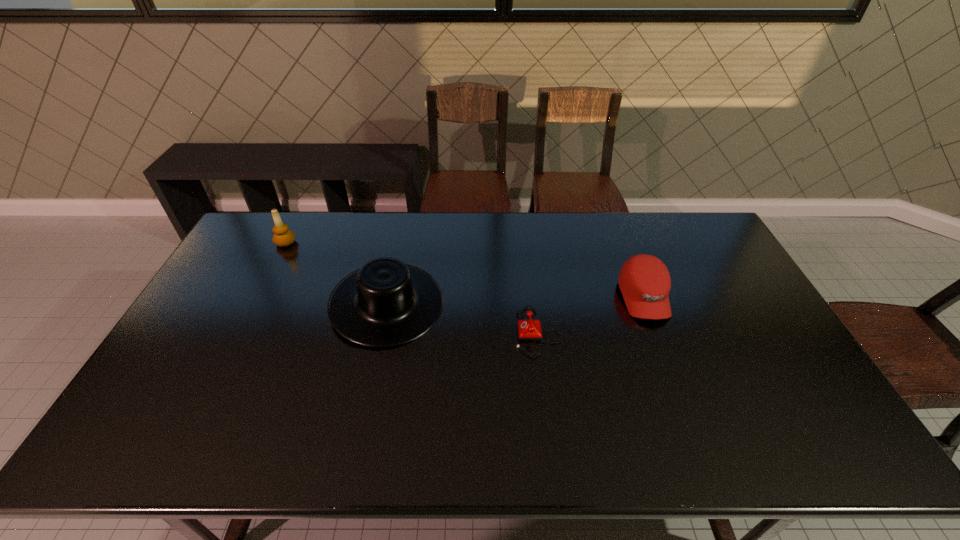
I want to click on free space that satisfies the following two spatial constraints: 1. on the front side of the farthest object; 2. on the right side of the third object from right to left, so click(254, 304).

This screenshot has width=960, height=540. In order to click on vacant space that satisfies the following two spatial constraints: 1. on the front side of the candle_holder; 2. on the left side of the dress hat in this screenshot , I will do `click(254, 304)`.